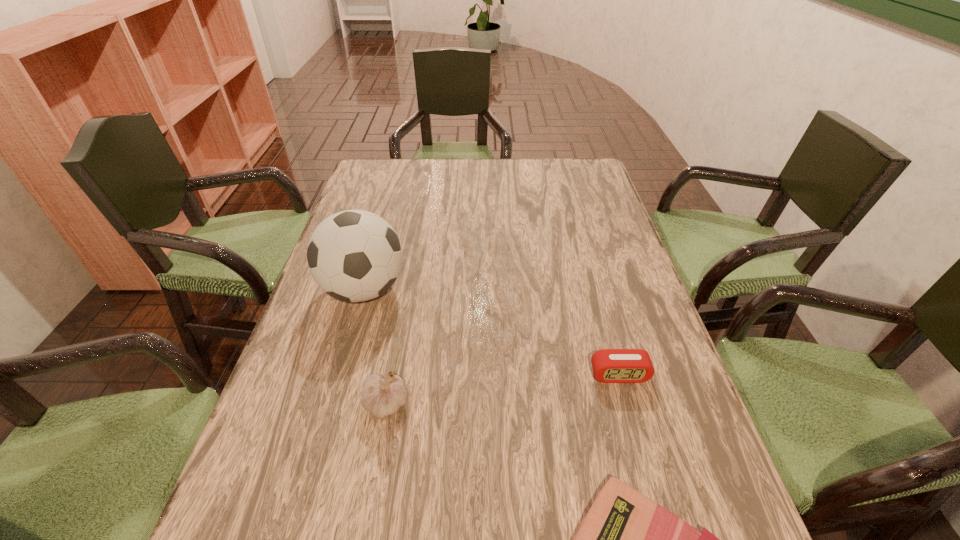
This screenshot has height=540, width=960. I want to click on object situated at the right edge, so click(x=609, y=365).

You are a GUI agent. You are given a task and a screenshot of the screen. Output one action in this format:
    pyautogui.click(x=<x>, y=<y>)
    Task: Click on the vacant space at the far edge
    The image size is (960, 540).
    Given the screenshot: What is the action you would take?
    pyautogui.click(x=466, y=166)

Where is `free space at the left edge`? free space at the left edge is located at coordinates (286, 407).

The image size is (960, 540). I want to click on vacant space at the right edge of the desktop, so click(x=647, y=292).

What are the coordinates of `free space at the far left corner of the desktop` in the screenshot? It's located at (382, 193).

Where is `blank area at the far right corner`? blank area at the far right corner is located at coordinates (578, 158).

You are a GUI agent. You are given a task and a screenshot of the screen. Output one action in this format:
    pyautogui.click(x=<x>, y=<y>)
    Task: Click on the empty location between the farthest object and the garlic
    This screenshot has height=540, width=960.
    Given the screenshot: What is the action you would take?
    [x=375, y=347]

Image resolution: width=960 pixels, height=540 pixels. In order to click on unoccupied area between the farthest object and the alarm clock in this screenshot , I will do `click(492, 332)`.

Locate an element on the screen. free space between the farthest object and the second tallest object is located at coordinates (375, 347).

Where is `free space between the alarm clock and the garlic`? free space between the alarm clock and the garlic is located at coordinates (503, 390).